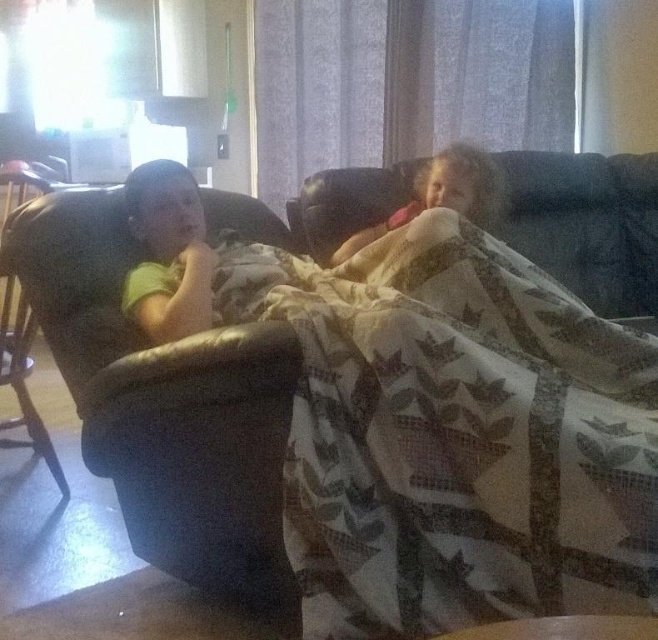
Question: Is printed fabric blanket at center thinner than black leather chair at left?

Choices:
 (A) no
 (B) yes

Answer: (A)

Question: Which object is positioned closest to the soft pink blanket at center?

Choices:
 (A) black leather chair at left
 (B) matte green shirt at left
 (C) printed fabric blanket at center
 (D) dark fabric couch at upper right

Answer: (D)

Question: Does soft pink blanket at center appear under black leather chair at left?

Choices:
 (A) no
 (B) yes

Answer: (A)

Question: Based on their relative distances, which object is farther from the dark fabric couch at upper right?

Choices:
 (A) printed fabric blanket at center
 (B) black leather chair at left

Answer: (B)

Question: Is matte green shirt at left to the right of soft pink blanket at center from the viewer's perspective?

Choices:
 (A) no
 (B) yes

Answer: (A)

Question: Which of the following is the farthest from the observer?

Choices:
 (A) (28, 404)
 (B) (449, 198)

Answer: (A)